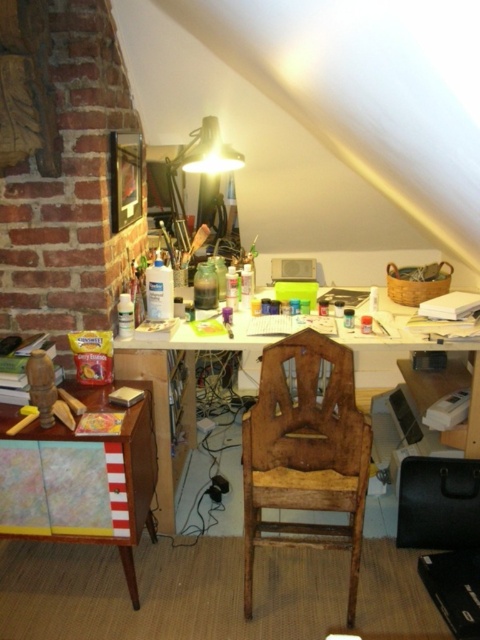
In the scene shown: Can you confirm if wooden desk at center is positioned below wooden cabinet at lower left?

Incorrect, wooden desk at center is not positioned below wooden cabinet at lower left.

The height and width of the screenshot is (640, 480). In order to click on wooden desk at center in this screenshot , I will do `click(183, 392)`.

Is point (115, 346) positioned after point (139, 406)?

Yes, point (115, 346) is behind point (139, 406).

The image size is (480, 640). Identify the location of wooden desk at center. (183, 392).

Does wooden chair at center have a lesser width compared to wooden desk at center?

Yes, wooden chair at center is thinner than wooden desk at center.

Does wooden chair at center come behind wooden desk at center?

No, wooden chair at center is closer to the viewer.

You are a GUI agent. You are given a task and a screenshot of the screen. Output one action in this format:
    pyautogui.click(x=<x>, y=<y>)
    Task: Click on the wooden chair at center
    
    Given the screenshot: What is the action you would take?
    pyautogui.click(x=304, y=452)

Is wooden chair at center wider than wooden cabinet at lower left?

No, wooden chair at center is not wider than wooden cabinet at lower left.

Is wooden chair at center further to camera compared to wooden cabinet at lower left?

No, wooden chair at center is closer to the viewer.

Locate an element on the screen. Image resolution: width=480 pixels, height=640 pixels. wooden chair at center is located at coordinates (304, 452).